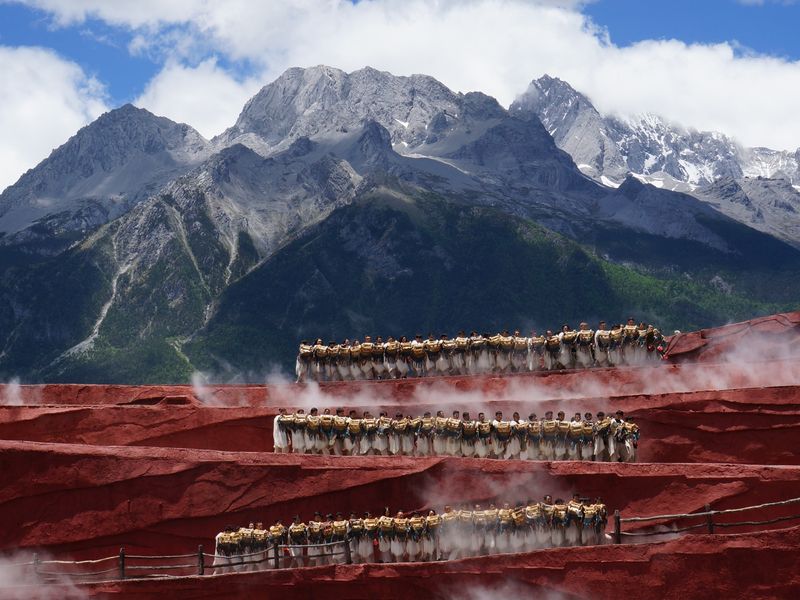
Where is `wooden railing`? wooden railing is located at coordinates (170, 560).